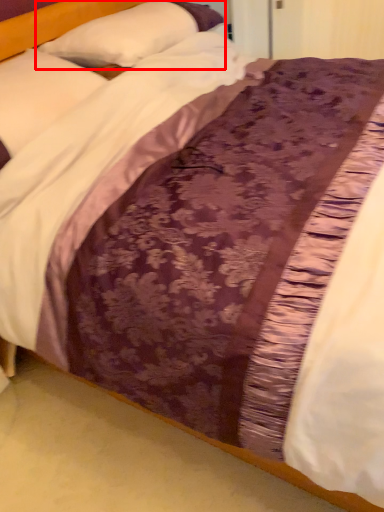
Question: From the image's perspective, considering the relative positions of pillow (annotated by the red box) and pillow in the image provided, where is pillow (annotated by the red box) located with respect to the staircase?

Choices:
 (A) above
 (B) below

Answer: (A)